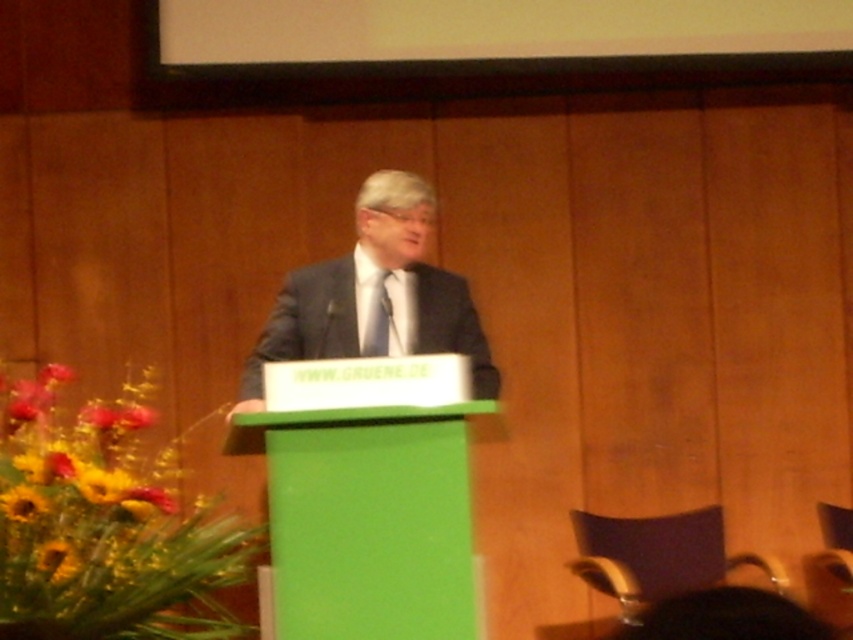
You are a photographer setting up for a speech event. You need to ensure that the dark gray suit at center and the yellow sunflower at lower left are both visible in your shot. Given their heights, which object will require you to adjust your camera angle upwards to capture properly?

The dark gray suit at center is taller than the yellow sunflower at lower left, so you will need to adjust your camera angle upwards to capture the dark gray suit at center properly.